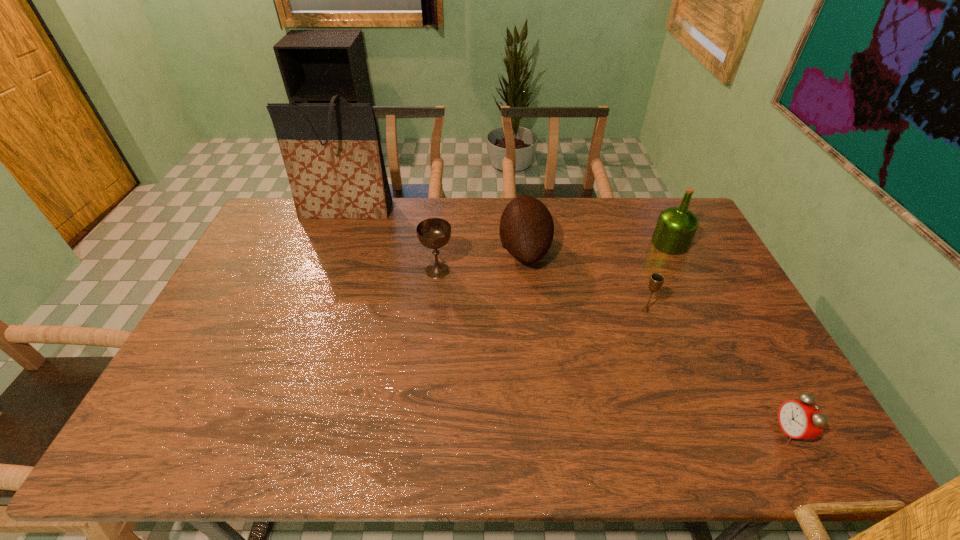
Find the location of `vacant space at the far edge of the desktop`. vacant space at the far edge of the desktop is located at coordinates (455, 213).

Find the location of a particular element. vacant space at the near edge of the desktop is located at coordinates (603, 424).

The width and height of the screenshot is (960, 540). In order to click on vacant region at the left edge of the desktop in this screenshot , I will do [x=252, y=299].

Find the location of `free region at the right edge of the desktop`. free region at the right edge of the desktop is located at coordinates (763, 415).

Where is `vacant space at the far left corner`? The width and height of the screenshot is (960, 540). vacant space at the far left corner is located at coordinates (302, 229).

This screenshot has width=960, height=540. Identify the location of free space at the near left corner of the desktop. (186, 424).

Find the location of a particular element. The height and width of the screenshot is (540, 960). vacant space at the far right corner of the desktop is located at coordinates (653, 229).

This screenshot has width=960, height=540. I want to click on vacant area that lies between the alarm clock and the football, so click(657, 340).

Locate an element on the screen. The width and height of the screenshot is (960, 540). free space between the second tallest object and the taller chalice is located at coordinates (554, 257).

Identify the location of free space between the right chalice and the shortest object. Image resolution: width=960 pixels, height=540 pixels. (717, 371).